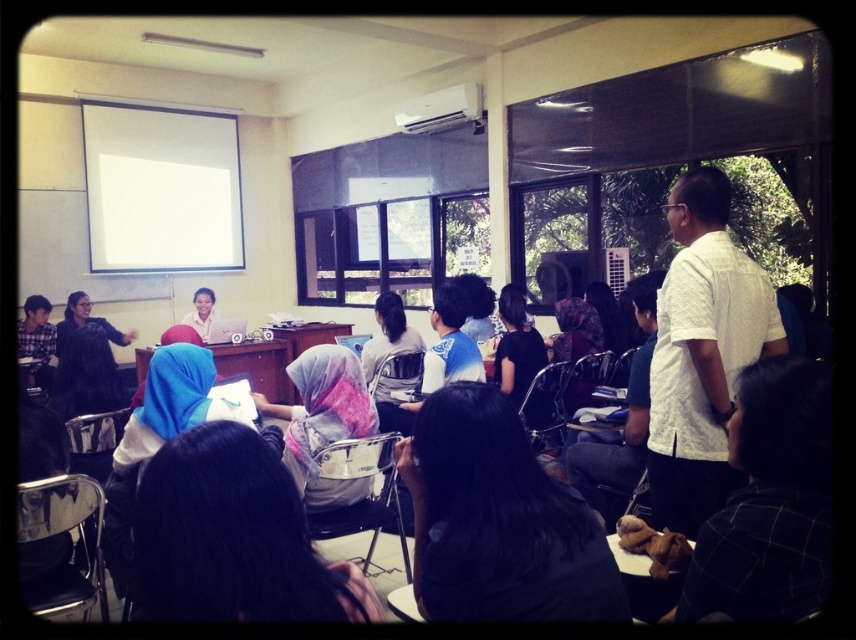
You are organizing a photo shoot in this classroom and need to arrange two shirts for a photoshoot setup. The white textured shirt at right and the matte white shirt at center are placed on a table. Since you want to create a balanced composition, which shirt should you place closer to the edge of the table to avoid overcrowding?

The white textured shirt at right has a lesser width compared to the matte white shirt at center, so placing the white textured shirt at right closer to the edge would help balance the composition as it takes up less space.

You are standing at the entrance of the classroom and want to hand a document to the person wearing the black fabric headscarf at center and the matte white shirt at center. However, you can only move forward 15 feet from your current position. Can you reach both individuals to hand them the document?

The black fabric headscarf at center is 16.68 feet away from matte white shirt at center. Since you can only move forward 15 feet, you cannot reach both individuals as the distance between them exceeds your movement limit.

You are a photographer standing in the classroom and want to take a photo of the two people wearing the black fabric headscarf at center and the matte white shirt at center. Which clothing item will appear shorter in the photo?

The black fabric headscarf at center will appear shorter in the photo because it has a lesser height compared to the matte white shirt at center.